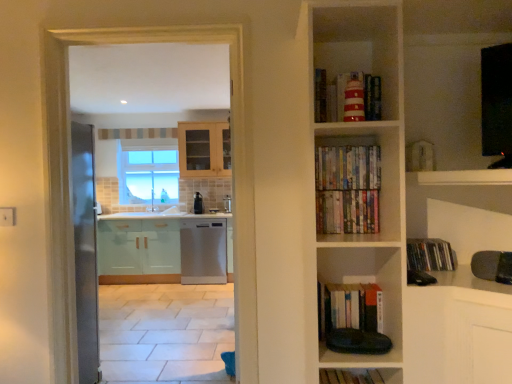
Locate an element on the screen. This screenshot has width=512, height=384. empty space that is ontop of multicolored paperbacks at center, marked as the 5th book in a bottom-to-top arrangement (from a real-world perspective) is located at coordinates (340, 147).